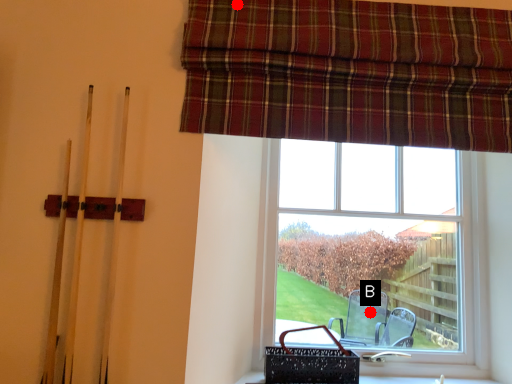
Question: Two points are circled on the image, labeled by A and B beside each circle. Which point is farther from the camera taking this photo?

Choices:
 (A) A is further
 (B) B is further

Answer: (B)